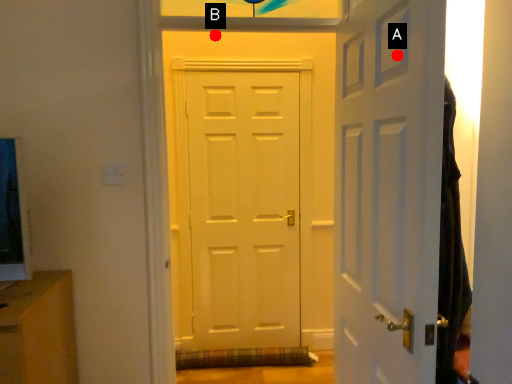
Question: Two points are circled on the image, labeled by A and B beside each circle. Which point is farther from the camera taking this photo?

Choices:
 (A) A is further
 (B) B is further

Answer: (B)